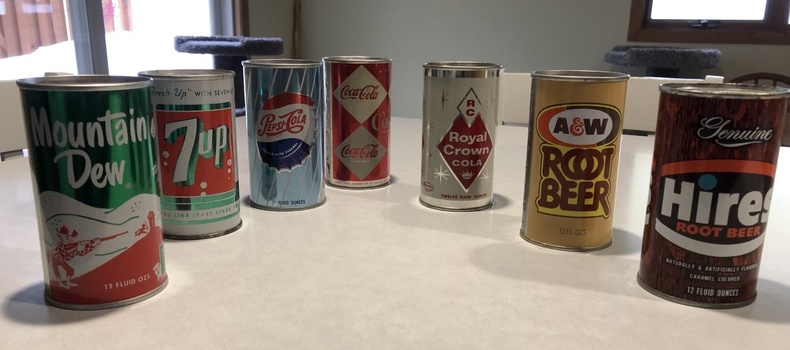
Where is `wall window`? The height and width of the screenshot is (350, 790). wall window is located at coordinates (734, 8).